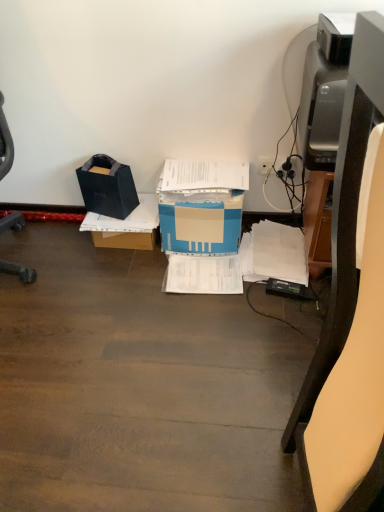
Identify the location of white plastic plug at upper right. The width and height of the screenshot is (384, 512). 265,164.

The image size is (384, 512). Describe the element at coordinates (279, 252) in the screenshot. I see `white paper at lower right, marked as the first document in a right-to-left arrangement` at that location.

Describe the element at coordinates (201, 206) in the screenshot. I see `blue cardboard box at center, the 1th box in the right-to-left sequence` at that location.

Describe the element at coordinates (107, 187) in the screenshot. This screenshot has height=512, width=384. I see `black matte bag at left, which is counted as the first box, starting from the left` at that location.

At what (x,y) coordinates should I click in order to perform the action: click on black matte bag at left, marked as the 2th box in a right-to-left arrangement. Please return your answer as a coordinate pair (x, y). This screenshot has height=512, width=384. Looking at the image, I should click on pos(107,187).

Describe the element at coordinates (126, 226) in the screenshot. This screenshot has height=512, width=384. I see `brown cardboard box at center` at that location.

Describe the element at coordinates (203, 274) in the screenshot. The height and width of the screenshot is (512, 384). I see `white paper at center, acting as the 2th document starting from the right` at that location.

The width and height of the screenshot is (384, 512). What do you see at coordinates (349, 315) in the screenshot?
I see `matte black printer at right` at bounding box center [349, 315].

The width and height of the screenshot is (384, 512). In order to click on matte black printer at right in this screenshot , I will do `click(349, 315)`.

Where is `white plastic plug at upper right`? white plastic plug at upper right is located at coordinates (265, 164).

Considering the relative sizes of matte black printer at right and blue cardboard box at center, the 1th box in the right-to-left sequence, in the image provided, is matte black printer at right bigger than blue cardboard box at center, the 1th box in the right-to-left sequence,?

Correct, matte black printer at right is larger in size than blue cardboard box at center, the 1th box in the right-to-left sequence.

What's the angular difference between matte black printer at right and blue cardboard box at center, placed as the second box when sorted from left to right,'s facing directions?

The angle between the facing direction of matte black printer at right and the facing direction of blue cardboard box at center, placed as the second box when sorted from left to right, is 85.6 degrees.

Is matte black printer at right shorter than blue cardboard box at center, the 1th box in the right-to-left sequence?

No.

Would you say matte black printer at right is outside blue cardboard box at center, the 1th box in the right-to-left sequence?

Indeed, matte black printer at right is completely outside blue cardboard box at center, the 1th box in the right-to-left sequence.

Is black matte bag at left, marked as the 2th box in a right-to-left arrangement, to the left of white plastic plug at upper right from the viewer's perspective?

Correct, you'll find black matte bag at left, marked as the 2th box in a right-to-left arrangement, to the left of white plastic plug at upper right.

From a real-world perspective, between black matte bag at left, marked as the 2th box in a right-to-left arrangement, and white plastic plug at upper right, who is vertically higher?

white plastic plug at upper right is physically above.

From the picture: Is white plastic plug at upper right completely or partially inside black matte bag at left, marked as the 2th box in a right-to-left arrangement?

Definitely not — white plastic plug at upper right is not inside black matte bag at left, marked as the 2th box in a right-to-left arrangement.

From the image's perspective, relative to white plastic plug at upper right, is black matte bag at left, marked as the 2th box in a right-to-left arrangement, above or below?

From the image's perspective, black matte bag at left, marked as the 2th box in a right-to-left arrangement, appears below white plastic plug at upper right.

Is point (218, 286) in front of point (137, 214)?

That is True.

From the image's perspective, is white paper at center, which is the first document from left to right, positioned above or below brown cardboard box at center?

Clearly, from the image's perspective, white paper at center, which is the first document from left to right, is below brown cardboard box at center.

Consider the image. Is white paper at center, which is the first document from left to right, positioned beyond the bounds of brown cardboard box at center?

white paper at center, which is the first document from left to right, is positioned outside brown cardboard box at center.

Considering the positions of objects white paper at center, acting as the 2th document starting from the right, and brown cardboard box at center in the image provided, who is in front, white paper at center, acting as the 2th document starting from the right, or brown cardboard box at center?

white paper at center, acting as the 2th document starting from the right, is closer to the camera.

Which of these two, white paper at lower right, marked as the first document in a right-to-left arrangement, or blue cardboard box at center, the 1th box in the right-to-left sequence, stands shorter?

white paper at lower right, marked as the first document in a right-to-left arrangement.

Is white paper at lower right, acting as the 2th document starting from the left, next to blue cardboard box at center, placed as the second box when sorted from left to right?

No, white paper at lower right, acting as the 2th document starting from the left, is not in contact with blue cardboard box at center, placed as the second box when sorted from left to right.

Which of these two, white paper at lower right, marked as the first document in a right-to-left arrangement, or blue cardboard box at center, the 1th box in the right-to-left sequence, is bigger?

With larger size is blue cardboard box at center, the 1th box in the right-to-left sequence.

Is white paper at lower right, marked as the first document in a right-to-left arrangement, outside of blue cardboard box at center, the 1th box in the right-to-left sequence?

Indeed, white paper at lower right, marked as the first document in a right-to-left arrangement, is completely outside blue cardboard box at center, the 1th box in the right-to-left sequence.

From a real-world perspective, starting from the black matte bag at left, marked as the 2th box in a right-to-left arrangement, which document is the 2nd one below it? Please provide its 2D coordinates.

[(203, 274)]

Is white paper at center, which is the first document from left to right, oriented away from black matte bag at left, marked as the 2th box in a right-to-left arrangement?

No.

Considering the positions of point (203, 279) and point (108, 181), is point (203, 279) closer or farther from the camera than point (108, 181)?

Point (203, 279) is closer to the camera than point (108, 181).

From a real-world perspective, is white paper at center, acting as the 2th document starting from the right, above or below black matte bag at left, which is counted as the first box, starting from the left?

white paper at center, acting as the 2th document starting from the right, is situated lower than black matte bag at left, which is counted as the first box, starting from the left, in the real world.

From the image's perspective, between white plastic plug at upper right and white paper at center, acting as the 2th document starting from the right, who is located below?

white paper at center, acting as the 2th document starting from the right.

Considering the relative positions of white plastic plug at upper right and white paper at center, acting as the 2th document starting from the right, in the image provided, is white plastic plug at upper right to the left of white paper at center, acting as the 2th document starting from the right, from the viewer's perspective?

In fact, white plastic plug at upper right is to the right of white paper at center, acting as the 2th document starting from the right.

Does white plastic plug at upper right have a lesser height compared to white paper at center, which is the first document from left to right?

Incorrect, the height of white plastic plug at upper right does not fall short of that of white paper at center, which is the first document from left to right.

Could you measure the distance between black matte bag at left, marked as the 2th box in a right-to-left arrangement, and white paper at lower right, acting as the 2th document starting from the left?

A distance of 64.40 centimeters exists between black matte bag at left, marked as the 2th box in a right-to-left arrangement, and white paper at lower right, acting as the 2th document starting from the left.

Is black matte bag at left, marked as the 2th box in a right-to-left arrangement, shorter than white paper at lower right, acting as the 2th document starting from the left?

In fact, black matte bag at left, marked as the 2th box in a right-to-left arrangement, may be taller than white paper at lower right, acting as the 2th document starting from the left.

Does black matte bag at left, marked as the 2th box in a right-to-left arrangement, turn towards white paper at lower right, marked as the first document in a right-to-left arrangement?

No, black matte bag at left, marked as the 2th box in a right-to-left arrangement, does not turn towards white paper at lower right, marked as the first document in a right-to-left arrangement.

Can you confirm if black matte bag at left, marked as the 2th box in a right-to-left arrangement, is bigger than white paper at lower right, acting as the 2th document starting from the left?

Yes, black matte bag at left, marked as the 2th box in a right-to-left arrangement, is bigger than white paper at lower right, acting as the 2th document starting from the left.

Where is `furniture below the blue cardboard box at center, placed as the second box when sorted from left to right (from the image's perspective)`? This screenshot has height=512, width=384. furniture below the blue cardboard box at center, placed as the second box when sorted from left to right (from the image's perspective) is located at coordinates (349, 315).

At what (x,y) coordinates should I click in order to perform the action: click on plug located above the black matte bag at left, which is counted as the first box, starting from the left (from a real-world perspective). Please return your answer as a coordinate pair (x, y). Image resolution: width=384 pixels, height=512 pixels. Looking at the image, I should click on (265, 164).

Based on their spatial positions, is blue cardboard box at center, the 1th box in the right-to-left sequence, or black matte bag at left, marked as the 2th box in a right-to-left arrangement, further from white paper at center, which is the first document from left to right?

Among the two, black matte bag at left, marked as the 2th box in a right-to-left arrangement, is located further to white paper at center, which is the first document from left to right.

Considering their positions, is white paper at lower right, marked as the first document in a right-to-left arrangement, positioned closer to matte black printer at right than brown cardboard box at center?

The object closer to matte black printer at right is white paper at lower right, marked as the first document in a right-to-left arrangement.

Estimate the real-world distances between objects in this image. Which object is closer to blue cardboard box at center, placed as the second box when sorted from left to right, white plastic plug at upper right or black matte bag at left, which is counted as the first box, starting from the left?

black matte bag at left, which is counted as the first box, starting from the left, lies closer to blue cardboard box at center, placed as the second box when sorted from left to right, than the other object.

Which object lies nearer to the anchor point brown cardboard box at center, blue cardboard box at center, the 1th box in the right-to-left sequence, or matte black printer at right?

blue cardboard box at center, the 1th box in the right-to-left sequence.

Considering their positions, is white plastic plug at upper right positioned further to black matte bag at left, which is counted as the first box, starting from the left, than white paper at center, which is the first document from left to right?

Among the two, white plastic plug at upper right is located further to black matte bag at left, which is counted as the first box, starting from the left.

Based on the photo, when comparing their distances from black matte bag at left, which is counted as the first box, starting from the left, does white paper at center, which is the first document from left to right, or white paper at lower right, acting as the 2th document starting from the left, seem closer?

white paper at center, which is the first document from left to right, is positioned closer to the anchor black matte bag at left, which is counted as the first box, starting from the left.

When comparing their distances from white plastic plug at upper right, does matte black printer at right or brown cardboard box at center seem closer?

The object closer to white plastic plug at upper right is brown cardboard box at center.

Based on their spatial positions, is white paper at lower right, marked as the first document in a right-to-left arrangement, or white paper at center, which is the first document from left to right, closer to white plastic plug at upper right?

The object closer to white plastic plug at upper right is white paper at lower right, marked as the first document in a right-to-left arrangement.

Locate an element on the screen. The height and width of the screenshot is (512, 384). cardboard box between black matte bag at left, marked as the 2th box in a right-to-left arrangement, and white paper at center, which is the first document from left to right, in the horizontal direction is located at coordinates (126, 226).

Image resolution: width=384 pixels, height=512 pixels. I want to click on cardboard box located between black matte bag at left, marked as the 2th box in a right-to-left arrangement, and white plastic plug at upper right in the left-right direction, so click(126, 226).

The width and height of the screenshot is (384, 512). Find the location of `box between black matte bag at left, marked as the 2th box in a right-to-left arrangement, and white paper at lower right, acting as the 2th document starting from the left, from left to right`. box between black matte bag at left, marked as the 2th box in a right-to-left arrangement, and white paper at lower right, acting as the 2th document starting from the left, from left to right is located at coordinates tap(201, 206).

Locate an element on the screen. The image size is (384, 512). document between black matte bag at left, marked as the 2th box in a right-to-left arrangement, and white paper at lower right, marked as the first document in a right-to-left arrangement, from left to right is located at coordinates (203, 274).